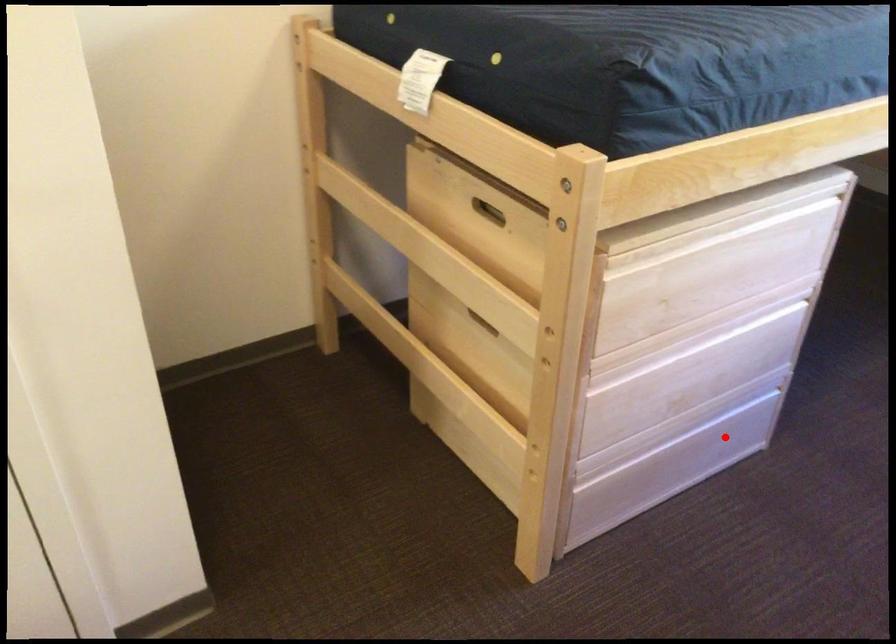
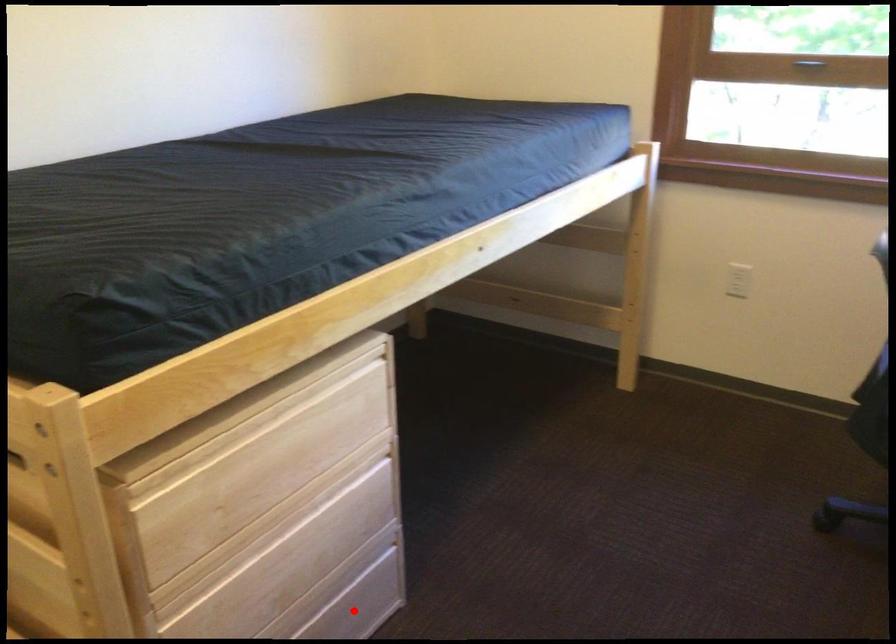
I am providing you with two images of the same scene from different viewpoints. A red point is marked on the first image and another point is marked on the second image. Is the red point in image1 aligned with the point shown in image2?

Yes